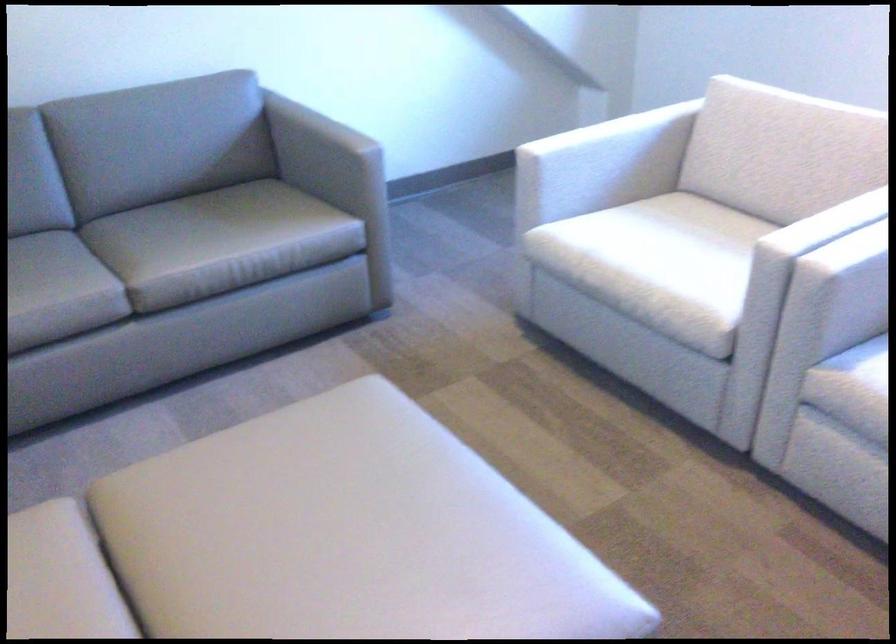
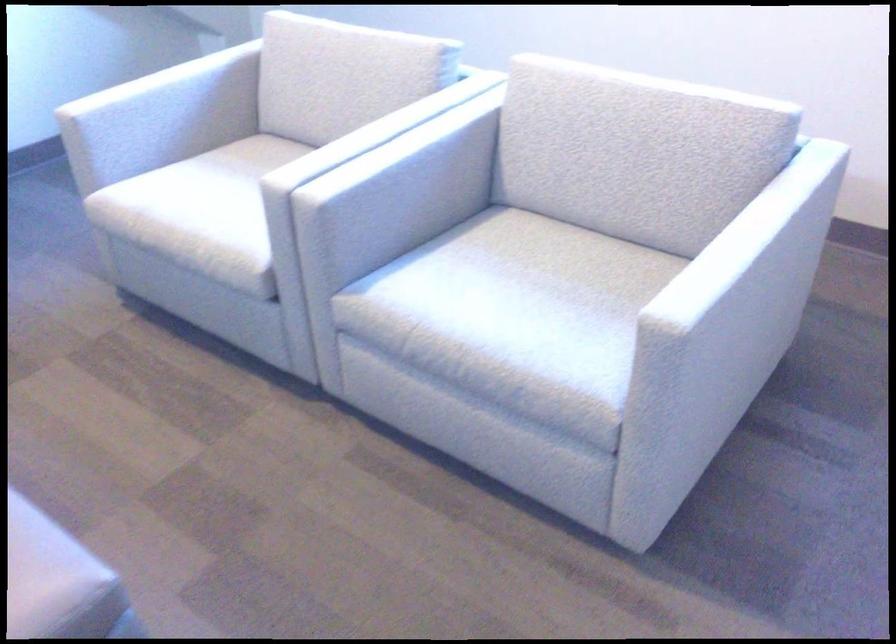
Locate, in the second image, the point that corresponds to (601,146) in the first image.

(150, 96)